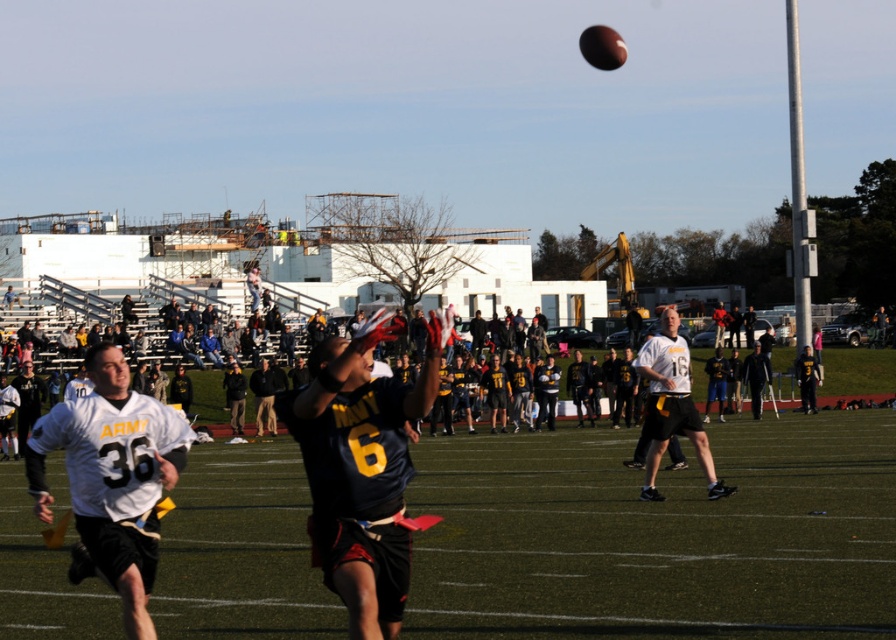
Question: Can you confirm if dark blue jersey at center is positioned below white matte jersey at center?

Choices:
 (A) no
 (B) yes

Answer: (A)

Question: Among these objects, which one is nearest to the camera?

Choices:
 (A) white matte jersey at center
 (B) white jersey at center
 (C) dark blue jersey at center

Answer: (C)

Question: Does dark blue jersey at center have a greater width compared to white jersey at center?

Choices:
 (A) yes
 (B) no

Answer: (A)

Question: Which point is closer to the camera?

Choices:
 (A) white matte jersey at center
 (B) white jersey at center
 (C) dark blue jersey at center

Answer: (C)

Question: Based on their relative distances, which object is farther from the white jersey at center?

Choices:
 (A) white matte jersey at center
 (B) dark blue jersey at center

Answer: (A)

Question: Is dark blue jersey at center wider than white matte jersey at center?

Choices:
 (A) yes
 (B) no

Answer: (A)